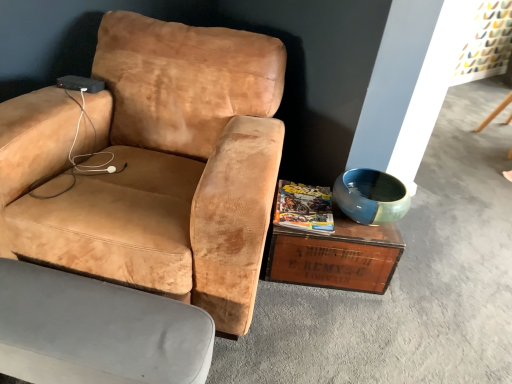
Question: From the image's perspective, is wooden crate at lower right positioned above or below suede tan chair at center, the 1th chair from the top?

Choices:
 (A) below
 (B) above

Answer: (A)

Question: Is point (336, 215) closer or farther from the camera than point (142, 125)?

Choices:
 (A) closer
 (B) farther

Answer: (B)

Question: Which object is the closest to the matte yellow magazine at center?

Choices:
 (A) blue glossy bowl at right
 (B) velvet beige armchair at lower left, the 2th chair when ordered from top to bottom
 (C) suede tan chair at center, the second chair from the bottom
 (D) wooden crate at lower right

Answer: (D)

Question: Which object is the closest to the wooden crate at lower right?

Choices:
 (A) matte yellow magazine at center
 (B) suede tan chair at center, the 1th chair from the top
 (C) velvet beige armchair at lower left, the 1th chair in the bottom-to-top sequence
 (D) blue glossy bowl at right

Answer: (A)